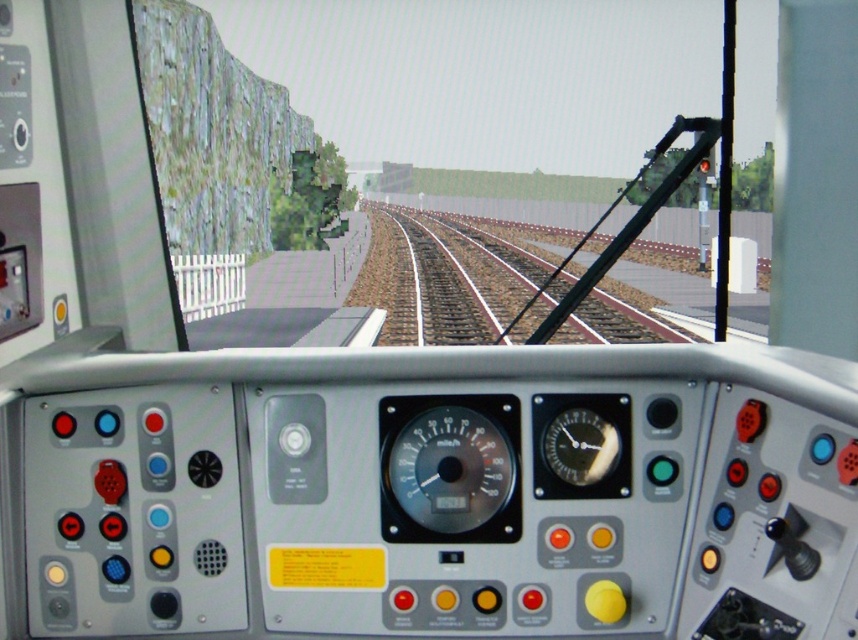
Question: Is the position of matte black speedometer at center less distant than that of shiny black clock at center?

Choices:
 (A) no
 (B) yes

Answer: (A)

Question: Does matte black speedometer at center appear under brown gravel track at center?

Choices:
 (A) yes
 (B) no

Answer: (A)

Question: In this image, where is brown gravel track at center located relative to shiny black clock at center?

Choices:
 (A) above
 (B) below

Answer: (A)

Question: Which object is closer to the camera taking this photo?

Choices:
 (A) matte black speedometer at center
 (B) shiny black clock at center
 (C) brown gravel track at center

Answer: (B)

Question: Which point appears closest to the camera in this image?

Choices:
 (A) (440, 515)
 (B) (591, 323)
 (C) (554, 420)

Answer: (C)

Question: Which point is closer to the camera taking this photo?

Choices:
 (A) (609, 424)
 (B) (656, 326)

Answer: (A)